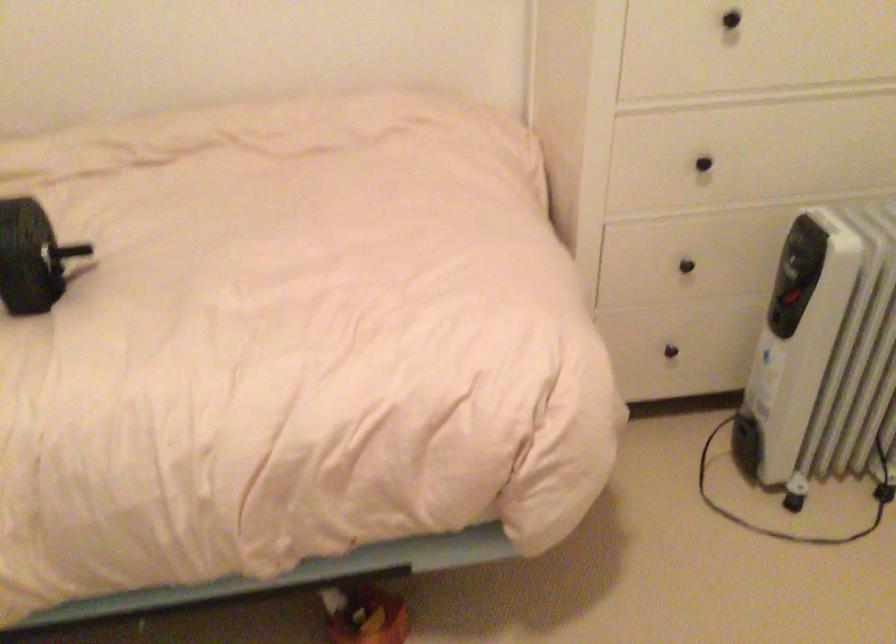
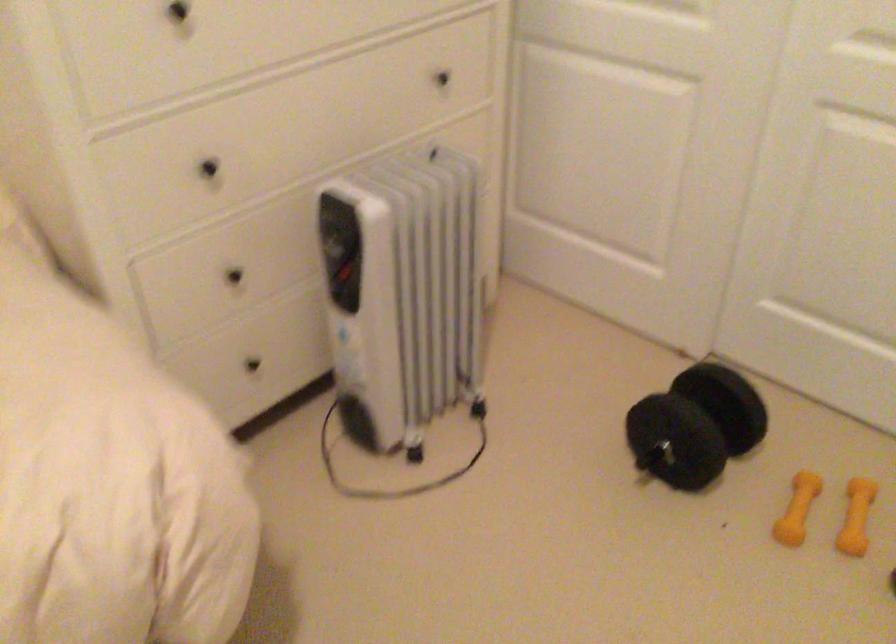
Locate, in the second image, the point that corresponds to (797,272) in the first image.

(340, 250)